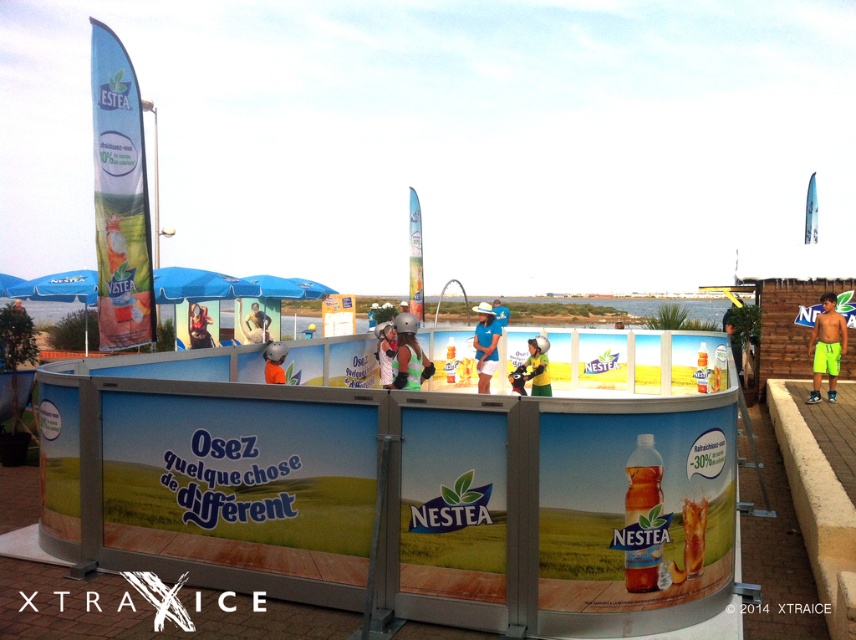
Which is below, matte white helmet at center or blue fabric helmet at center?

matte white helmet at center is lower down.

Is matte white helmet at center bigger than blue fabric helmet at center?

Incorrect, matte white helmet at center is not larger than blue fabric helmet at center.

You are a GUI agent. You are given a task and a screenshot of the screen. Output one action in this format:
    pyautogui.click(x=<x>, y=<y>)
    Task: Click on the matte white helmet at center
    This screenshot has height=640, width=856.
    Given the screenshot: What is the action you would take?
    pyautogui.click(x=385, y=352)

Between metallic helmet at center and orange fabric helmet at center, which one is positioned lower?

orange fabric helmet at center is below.

Does metallic helmet at center have a greater width compared to orange fabric helmet at center?

→ Yes, metallic helmet at center is wider than orange fabric helmet at center.

Between point (419, 348) and point (276, 372), which one is positioned in front?

Point (276, 372)

Where is `metallic helmet at center`? The width and height of the screenshot is (856, 640). metallic helmet at center is located at coordinates (407, 353).

Is neon green shorts at right wider than blue fabric helmet at center?

In fact, neon green shorts at right might be narrower than blue fabric helmet at center.

Between neon green shorts at right and blue fabric helmet at center, which one appears on the right side from the viewer's perspective?

From the viewer's perspective, neon green shorts at right appears more on the right side.

Does point (828, 317) lie behind point (492, 300)?

No, (828, 317) is closer to viewer.

Identify the location of neon green shorts at right. The image size is (856, 640). (x=825, y=346).